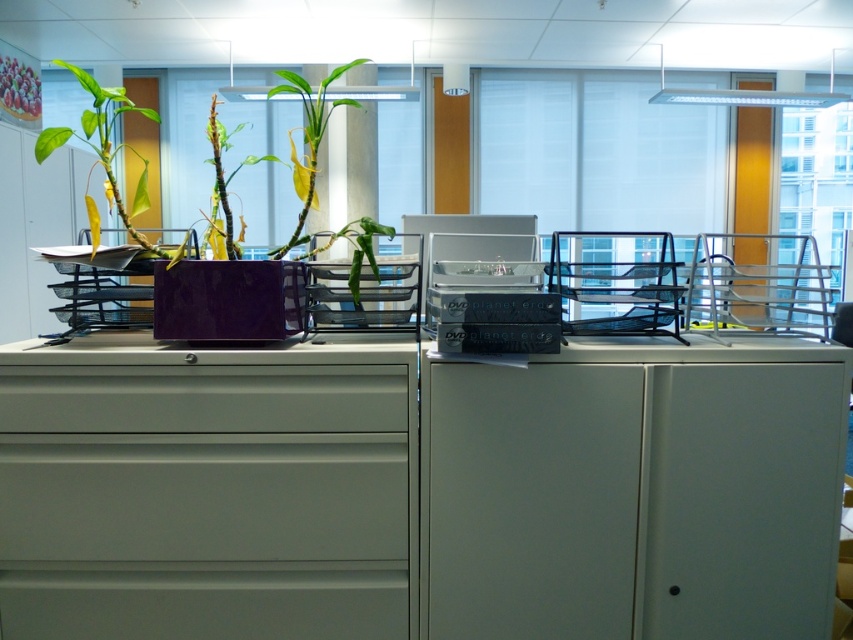
Between point (136, 230) and point (241, 253), which one is positioned in front?

Point (136, 230)

Which of these two, matte purple planter at left or matte plastic plant at center, stands shorter?

Standing shorter between the two is matte plastic plant at center.

You are a GUI agent. You are given a task and a screenshot of the screen. Output one action in this format:
    pyautogui.click(x=<x>, y=<y>)
    Task: Click on the matte purple planter at left
    This screenshot has width=853, height=640.
    Given the screenshot: What is the action you would take?
    pyautogui.click(x=111, y=154)

Does matte gray file cabinet at center appear over matte purple planter at left?

Incorrect, matte gray file cabinet at center is not positioned above matte purple planter at left.

Between matte gray file cabinet at center and matte purple planter at left, which one has less height?

matte gray file cabinet at center is shorter.

In order to click on matte gray file cabinet at center in this screenshot , I will do `click(207, 490)`.

Which is in front, point (125, 476) or point (125, 440)?

Positioned in front is point (125, 440).

Image resolution: width=853 pixels, height=640 pixels. In order to click on matte gray file cabinet at center in this screenshot , I will do [207, 490].